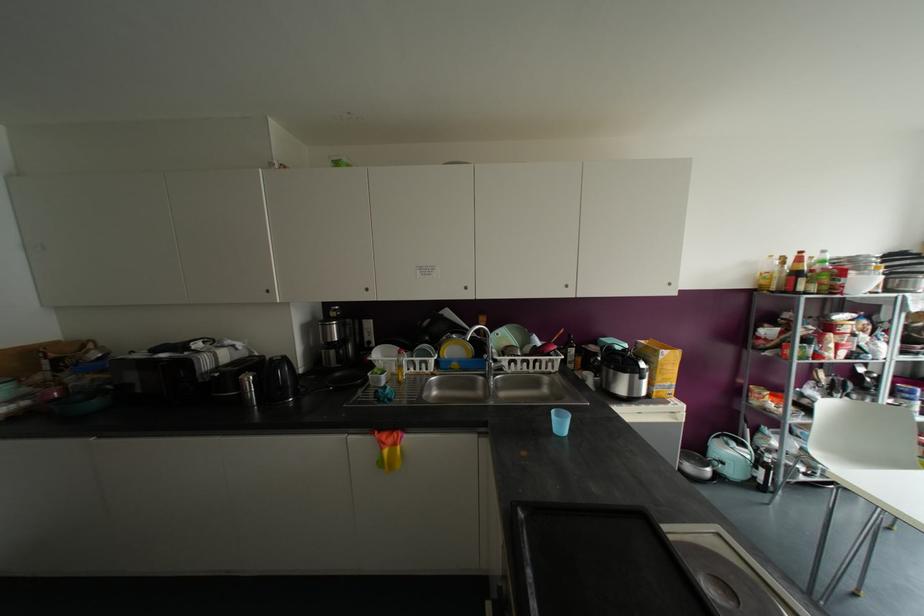
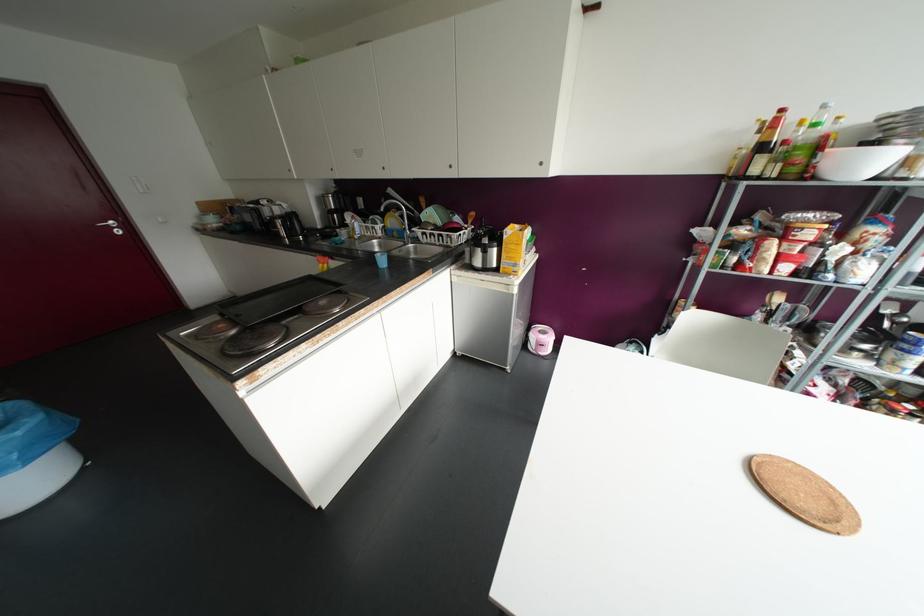
Find the pixel in the second image that matches the point at 561,424 in the first image.

(382, 261)